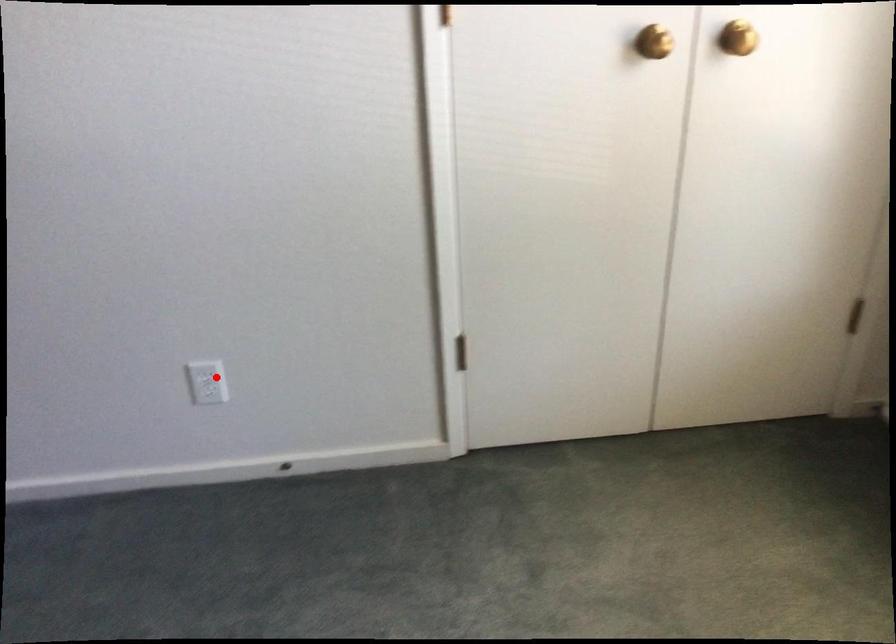
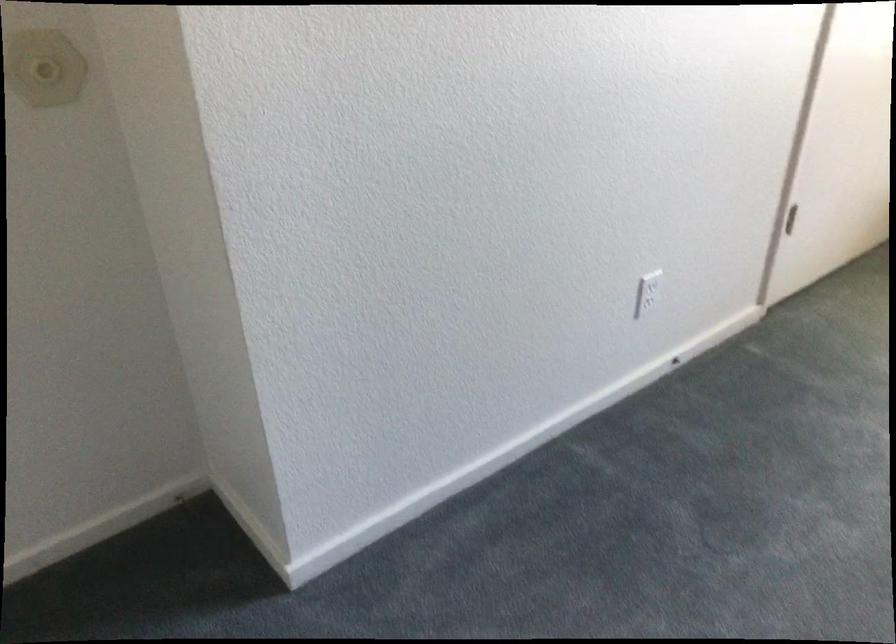
Where in the second image is the point corresponding to the highlighted location from the first image?

(650, 285)